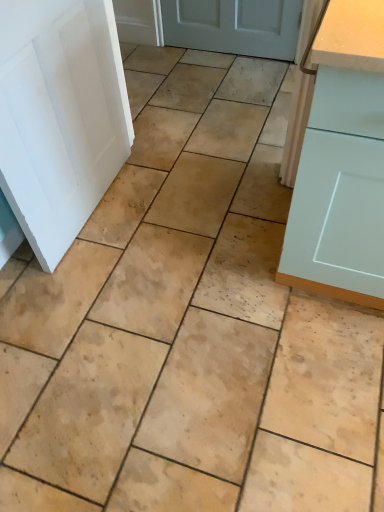
Find the location of a particular element. The height and width of the screenshot is (512, 384). vacant space in front of light blue matte cabinet at right is located at coordinates (310, 374).